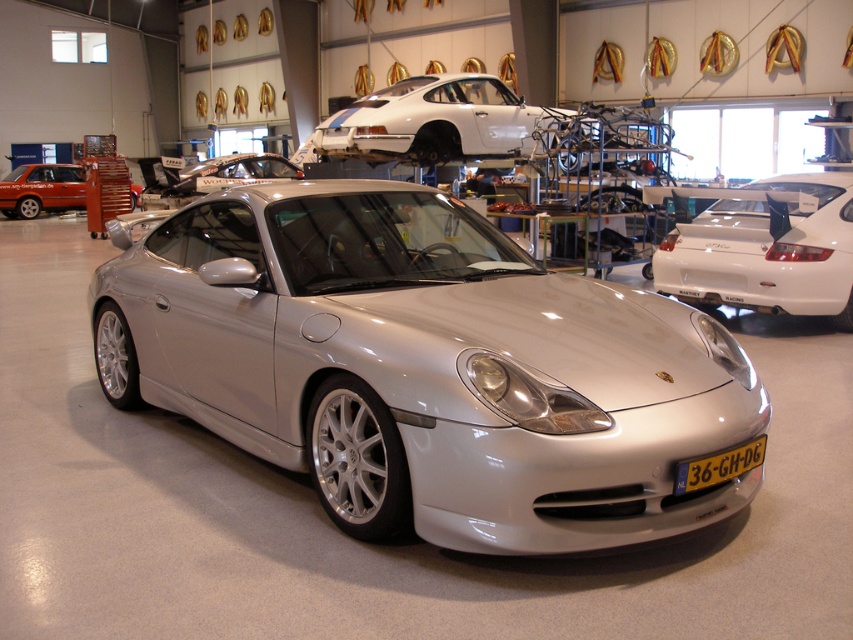
Question: Which object appears farthest from the camera in this image?

Choices:
 (A) white matte car at upper center
 (B) satin silver spoiler at center

Answer: (B)

Question: Estimate the real-world distances between objects in this image. Which object is farther from the matte orange van at left?

Choices:
 (A) white matte porsche at center
 (B) yellow plastic license plate at center

Answer: (B)

Question: From the image, what is the correct spatial relationship of silver metallic car at center in relation to white matte car at upper center?

Choices:
 (A) below
 (B) above

Answer: (A)

Question: Which is nearer to the silver metallic car at center?

Choices:
 (A) white matte porsche at center
 (B) yellow plastic license plate at center

Answer: (B)

Question: Does satin silver spoiler at center appear on the left side of yellow plastic license plate at center?

Choices:
 (A) yes
 (B) no

Answer: (A)

Question: Is the position of satin silver spoiler at center less distant than that of yellow plastic license plate at center?

Choices:
 (A) no
 (B) yes

Answer: (A)